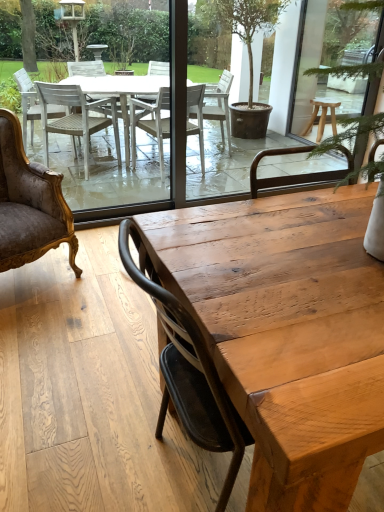
At what (x,y) coordinates should I click in order to perform the action: click on velvet gold armchair at left. Please return your answer as a coordinate pair (x, y). This screenshot has height=512, width=384. Looking at the image, I should click on (29, 204).

The width and height of the screenshot is (384, 512). What do you see at coordinates (29, 204) in the screenshot?
I see `velvet gold armchair at left` at bounding box center [29, 204].

The height and width of the screenshot is (512, 384). I want to click on natural wood table at center, so click(x=286, y=331).

The height and width of the screenshot is (512, 384). What do you see at coordinates (286, 331) in the screenshot?
I see `natural wood table at center` at bounding box center [286, 331].

The image size is (384, 512). What are the coordinates of `velvet gold armchair at left` in the screenshot? It's located at (29, 204).

Considering the relative positions of natural wood table at center and velvet gold armchair at left in the image provided, is natural wood table at center to the left or to the right of velvet gold armchair at left?

natural wood table at center is to the right of velvet gold armchair at left.

From the picture: Which object is closer to the camera, natural wood table at center or velvet gold armchair at left?

Positioned in front is natural wood table at center.

Is point (325, 354) farther from viewer compared to point (2, 125)?

No, it is in front of (2, 125).

From the image's perspective, is natural wood table at center located above or below velvet gold armchair at left?

natural wood table at center is below velvet gold armchair at left.

From a real-world perspective, is natural wood table at center under velvet gold armchair at left?

Yes.

Does natural wood table at center have a greater width compared to velvet gold armchair at left?

Yes.

Which of these two, natural wood table at center or velvet gold armchair at left, stands shorter?

natural wood table at center.

Is natural wood table at center smaller than velvet gold armchair at left?

Incorrect, natural wood table at center is not smaller in size than velvet gold armchair at left.

Does natural wood table at center contain velvet gold armchair at left?

No, velvet gold armchair at left is not surrounded by natural wood table at center.

Is natural wood table at center touching velvet gold armchair at left?

natural wood table at center and velvet gold armchair at left are clearly separated.

Is natural wood table at center oriented away from velvet gold armchair at left?

No, natural wood table at center's orientation is not away from velvet gold armchair at left.

What's the angular difference between natural wood table at center and velvet gold armchair at left's facing directions?

There is a 69.3-degree angle between the facing directions of natural wood table at center and velvet gold armchair at left.

Locate an element on the screen. This screenshot has width=384, height=512. coffee table below the velvet gold armchair at left (from a real-world perspective) is located at coordinates tap(286, 331).

Is velvet gold armchair at left to the left of natural wood table at center from the viewer's perspective?

Yes.

Which object is further away from the camera, velvet gold armchair at left or natural wood table at center?

velvet gold armchair at left.

Considering the positions of point (19, 139) and point (185, 268), is point (19, 139) closer or farther from the camera than point (185, 268)?

Clearly, point (19, 139) is more distant from the camera than point (185, 268).

From the image's perspective, is velvet gold armchair at left under natural wood table at center?

Incorrect, from the image's perspective, velvet gold armchair at left is higher than natural wood table at center.

From a real-world perspective, between velvet gold armchair at left and natural wood table at center, who is vertically higher?

In real-world perspective, velvet gold armchair at left is above.

Which of these two, velvet gold armchair at left or natural wood table at center, is thinner?

velvet gold armchair at left is thinner.

Which of these two, velvet gold armchair at left or natural wood table at center, stands taller?

Standing taller between the two is velvet gold armchair at left.

Which of these two, velvet gold armchair at left or natural wood table at center, is bigger?

With larger size is natural wood table at center.

Is velvet gold armchair at left surrounding natural wood table at center?

That's incorrect, natural wood table at center is not inside velvet gold armchair at left.

Are velvet gold armchair at left and natural wood table at center making contact?

velvet gold armchair at left and natural wood table at center are not in contact.

Is velvet gold armchair at left oriented away from natural wood table at center?

velvet gold armchair at left is not turned away from natural wood table at center.

How much distance is there between velvet gold armchair at left and natural wood table at center?

4.63 feet.

The width and height of the screenshot is (384, 512). Identify the location of coffee table located in front of the velvet gold armchair at left. click(x=286, y=331).

At what (x,y) coordinates should I click in order to perform the action: click on chair behind the natural wood table at center. Please return your answer as a coordinate pair (x, y). This screenshot has width=384, height=512. Looking at the image, I should click on (29, 204).

There is a natural wood table at center. Where is `chair above it (from a real-world perspective)`? chair above it (from a real-world perspective) is located at coordinates (29, 204).